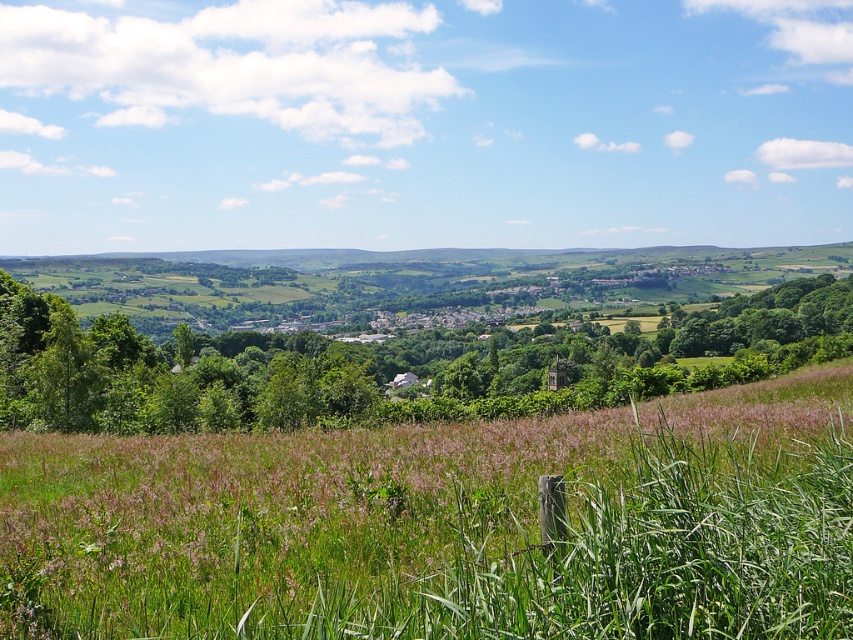
Who is lower down, green grass at center or green leafy tree at center?

green grass at center

Does point (306, 573) lie in front of point (723, 314)?

Yes.

Locate an element on the screen. The height and width of the screenshot is (640, 853). green grass at center is located at coordinates (445, 525).